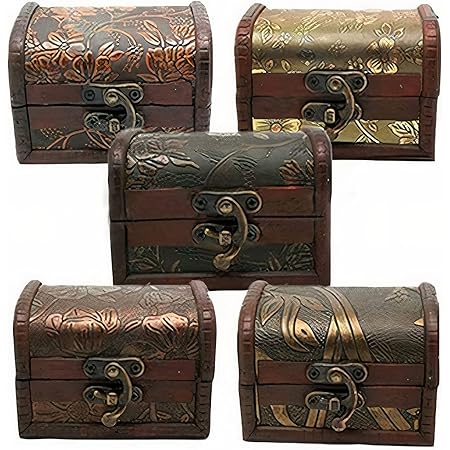
You are a GUI agent. You are given a task and a screenshot of the screen. Output one action in this format:
    pyautogui.click(x=<x>, y=<y>)
    Task: Click on the curved handle with gold edge on right side
    The image size is (450, 450).
    Given the screenshot: What is the action you would take?
    pyautogui.click(x=352, y=394), pyautogui.click(x=128, y=393), pyautogui.click(x=241, y=227)